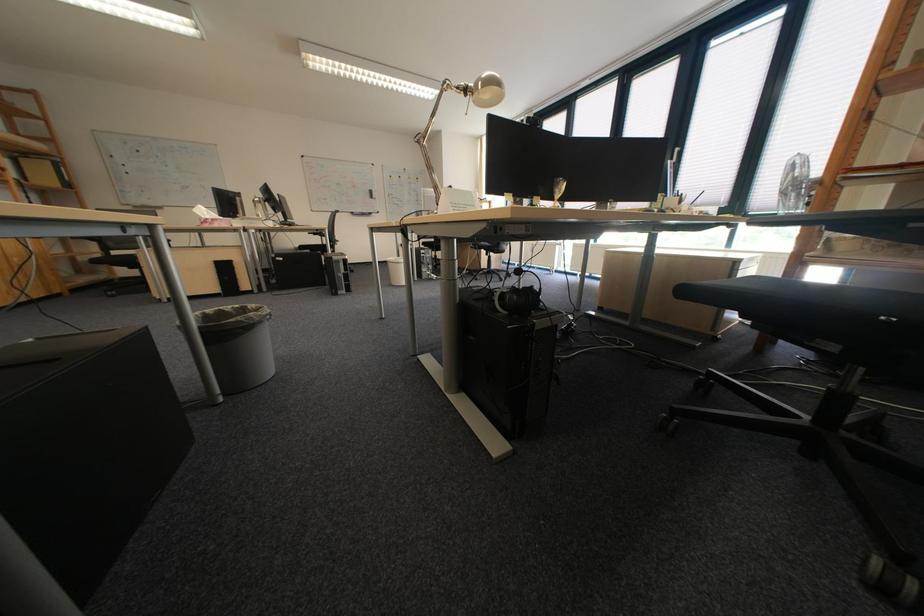
This screenshot has width=924, height=616. In order to click on chair sitting surface in this screenshot , I will do `click(819, 297)`.